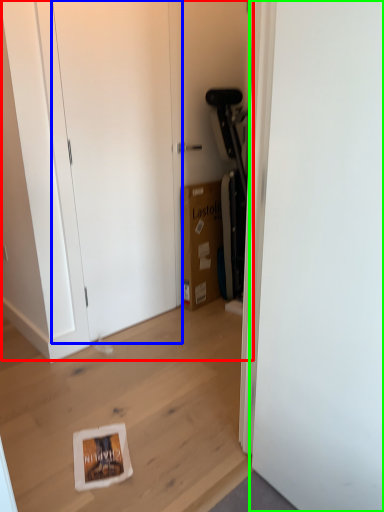
Question: Considering the real-world distances, which object is closest to dresser (highlighted by a red box)? door (highlighted by a blue box) or door (highlighted by a green box).

Choices:
 (A) door
 (B) door

Answer: (A)